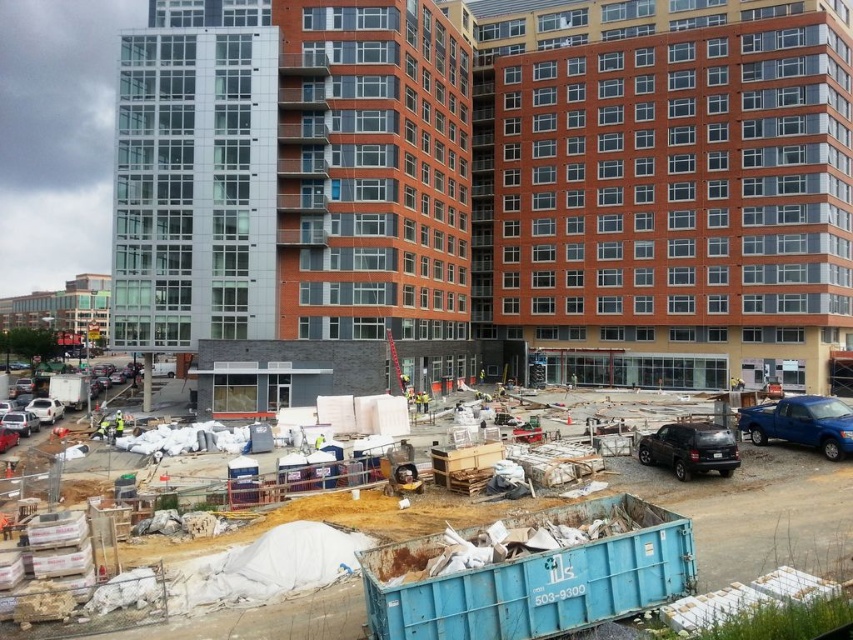
Question: Among these objects, which one is farthest from the camera?

Choices:
 (A) yellow reflective vest at center
 (B) blue metallic truck at lower right
 (C) silver metallic sedan at lower left
 (D) matte black suv at lower right

Answer: (C)

Question: Among these objects, which one is farthest from the camera?

Choices:
 (A) white matte car at lower left
 (B) yellow reflective vest at center
 (C) blue metallic truck at lower right

Answer: (A)

Question: Considering the relative positions of blue plastic container at center and yellow reflective vest at center in the image provided, where is blue plastic container at center located with respect to yellow reflective vest at center?

Choices:
 (A) below
 (B) above

Answer: (A)

Question: Is blue plastic container at center to the right of blue metallic truck at lower right from the viewer's perspective?

Choices:
 (A) yes
 (B) no

Answer: (B)

Question: Which object is positioned closest to the yellow reflective vest at center?

Choices:
 (A) matte black suv at lower right
 (B) blue plastic container at center
 (C) blue metallic truck at lower right
 (D) white matte car at lower left

Answer: (D)

Question: Considering the relative positions of silver metallic sedan at lower left and white matte car at lower left in the image provided, where is silver metallic sedan at lower left located with respect to white matte car at lower left?

Choices:
 (A) below
 (B) above

Answer: (A)